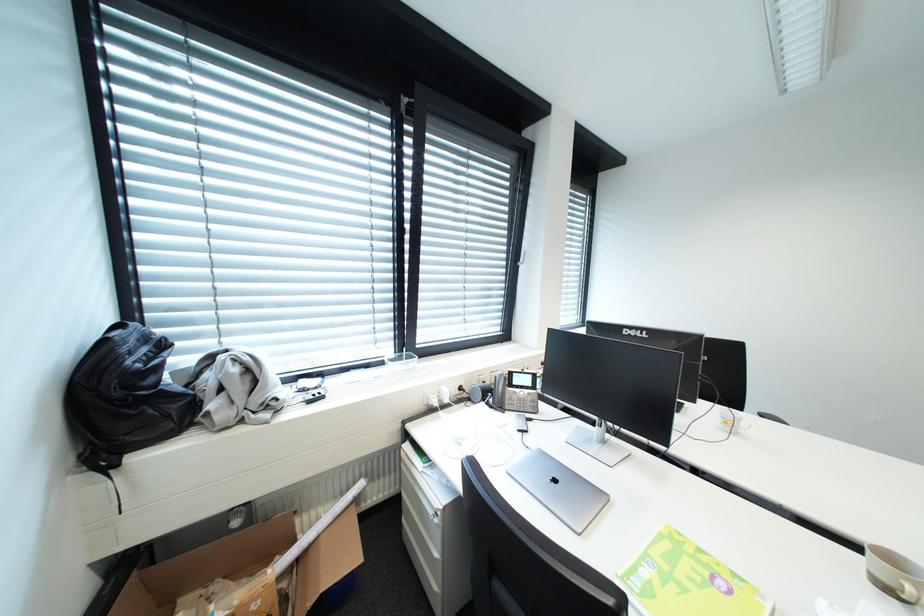
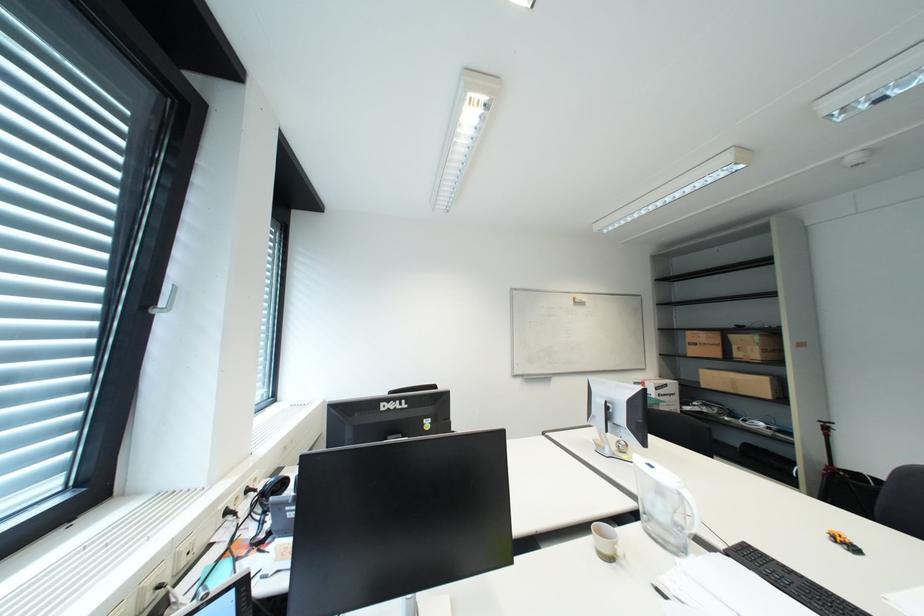
Question: The first image is from the beginning of the video and the second image is from the end. How did the camera likely rotate when shooting the video?

Choices:
 (A) Left
 (B) Right
 (C) Up
 (D) Down

Answer: (B)